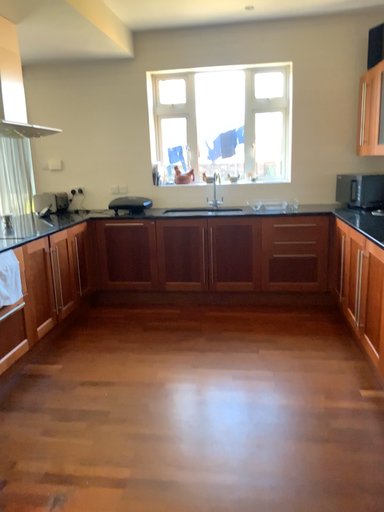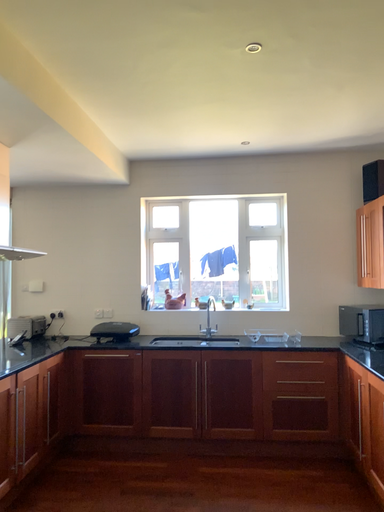
Question: Which way did the camera rotate in the video?

Choices:
 (A) rotated upward
 (B) rotated downward

Answer: (A)